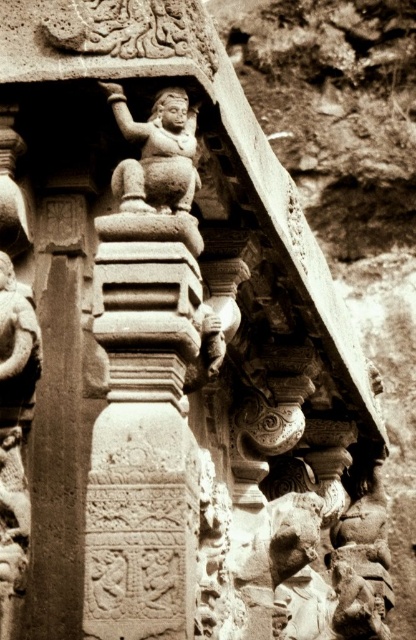
Question: Is carved stone column at center behind stone carved deity at upper center?

Choices:
 (A) no
 (B) yes

Answer: (A)

Question: Is carved stone column at center to the right of stone carved deity at upper center from the viewer's perspective?

Choices:
 (A) no
 (B) yes

Answer: (A)

Question: Which of the following is the closest to the observer?

Choices:
 (A) stone carved deity at upper center
 (B) carved stone column at center

Answer: (B)

Question: Among these objects, which one is farthest from the camera?

Choices:
 (A) stone carved deity at upper center
 (B) carved stone column at center

Answer: (A)

Question: Can you confirm if carved stone column at center is smaller than stone carved deity at upper center?

Choices:
 (A) yes
 (B) no

Answer: (B)